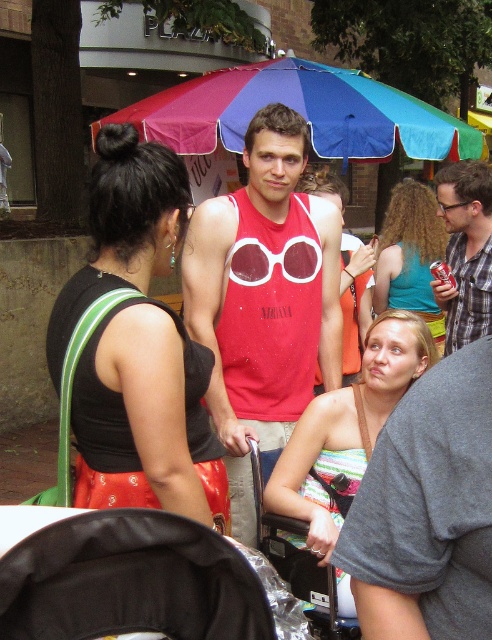
You are standing at the center of the scene and want to find the transparent plastic goggles at center. According to the coordinates provided, in which direction should you look to locate them?

The transparent plastic goggles at center are located at coordinates point (x=274, y=260), which means you should look slightly to the right and down from the exact center of the scene to find them.

You are at the event and need to choose a pair of goggles to wear under the colorful umbrella. The transparent plastic goggles at center and the matte plastic goggles at center are available. Which pair might be wider?

The transparent plastic goggles at center might be wider than the matte plastic goggles at center, so you should choose the transparent plastic goggles at center if you want a wider pair.

You are standing at the center of the plaza and want to move towards the rainbow fabric umbrella at center. Which direction should you go?

You should move towards the point at coordinates (300, 113) to reach the rainbow fabric umbrella at center.